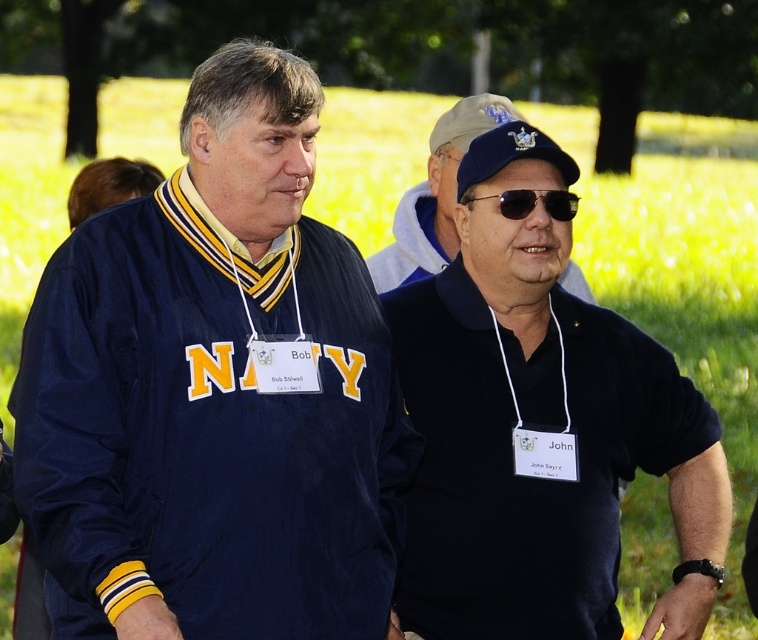
You are a photographer standing in the park and want to position yourself so that the black matte shirt at right is centered in your viewfinder. What are the coordinates you should aim for?

The coordinates to center the black matte shirt at right in the viewfinder are 0.672 on the x axis and 0.714 on the y axis.

You are a photographer setting up for a portrait in the park. You have two points marked on your viewfinder at coordinates point (x=390, y=280) and point (x=490, y=196). Which point is closer to the camera?

Point (x=390, y=280) is further to the camera than point (x=490, y=196), so the point closer to the camera is point (x=490, y=196).

You are a fashion designer analyzing clothing items in an image. You notice the navy fabric jacket at left and the black matte shirt at right. Based on their sizes, which clothing item would require more fabric to produce?

The navy fabric jacket at left has a greater height compared to the black matte shirt at right, so it would require more fabric to produce.